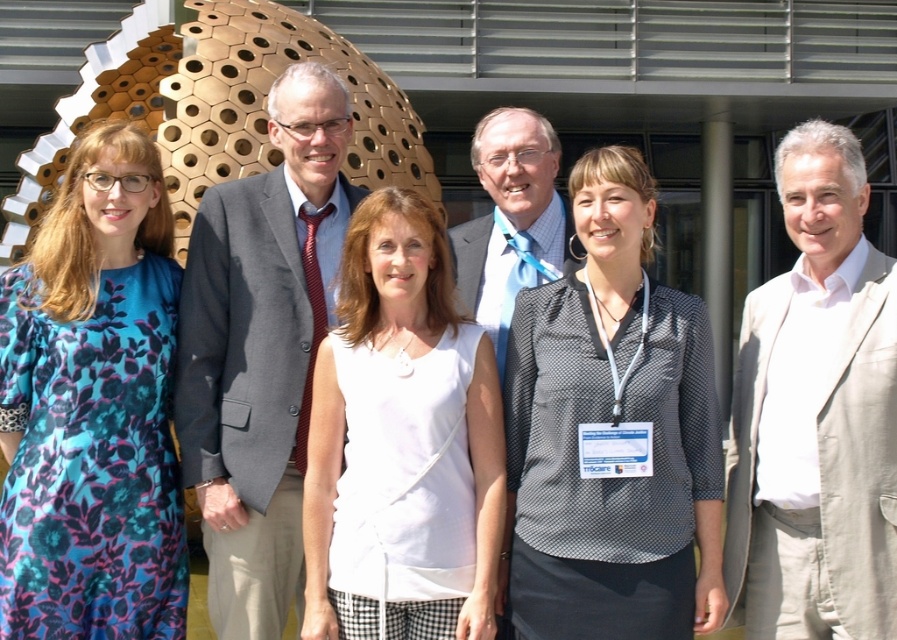
Based on the photo, you are a photographer trying to capture a group photo of the polka dot blouse at center and the white fabric shirt at center. Based on their heights, which one should you position closer to the camera to ensure both are visible in the frame?

Since the polka dot blouse at center is much taller than the white fabric shirt at center, you should position the white fabric shirt at center closer to the camera to ensure both are visible in the frame.

You are a photographer trying to capture a closeup of the polka dot blouse at center and the white fabric shirt at center. Which one should you focus on first if you want to ensure both are in focus without adjusting the camera settings?

The polka dot blouse at center is located above the white fabric shirt at center. Since they are at different heights, you should focus on the one closer to the camera first. However, without knowing the exact distance, it is recommended to focus on the middle point between them for better depth of field coverage.